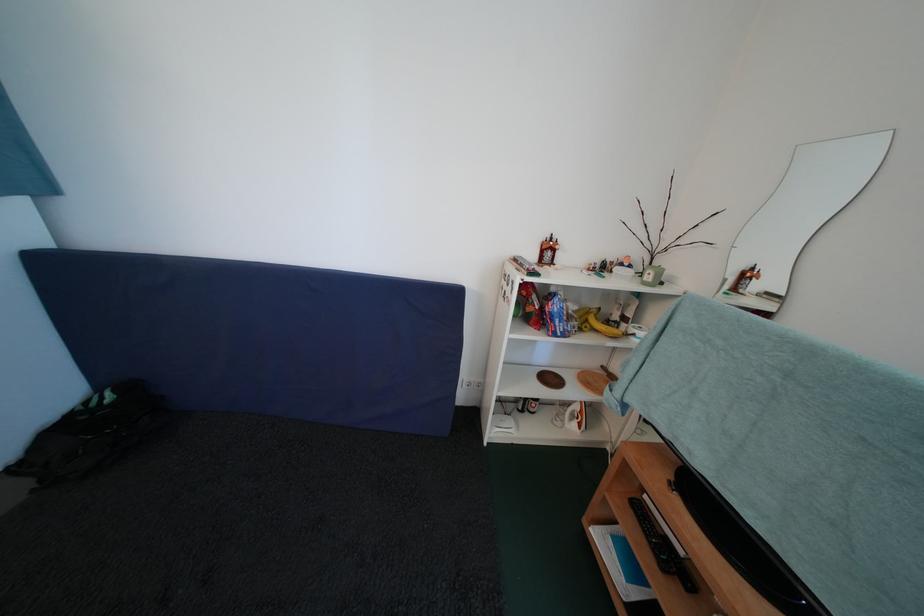
This screenshot has height=616, width=924. In order to click on green ceramic pot in this screenshot , I will do `click(651, 275)`.